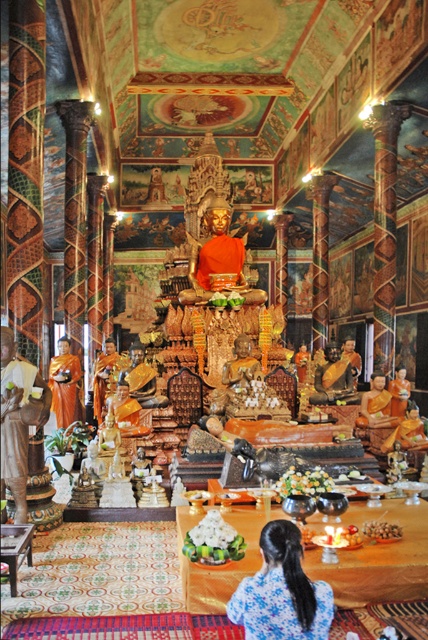
Question: Can you confirm if blue silk dress at center is positioned to the left of orange fabric robe at center?

Choices:
 (A) yes
 (B) no

Answer: (B)

Question: Which point is farther to the camera?

Choices:
 (A) blue silk dress at center
 (B) matte gold statue at right
 (C) orange fabric robe at center
 (D) gold metallic statue at left

Answer: (B)

Question: Which point is closer to the camera?

Choices:
 (A) gold metallic statue at left
 (B) orange fabric robe at center
 (C) blue silk dress at center
 (D) matte gold statue at right

Answer: (C)

Question: Which object is the closest to the gold metallic statue at left?

Choices:
 (A) blue silk dress at center
 (B) orange fabric robe at center
 (C) matte gold statue at right

Answer: (B)

Question: Does blue silk dress at center have a larger size compared to gold metallic statue at left?

Choices:
 (A) no
 (B) yes

Answer: (A)

Question: Can you confirm if blue silk dress at center is thinner than gold metallic statue at left?

Choices:
 (A) yes
 (B) no

Answer: (B)